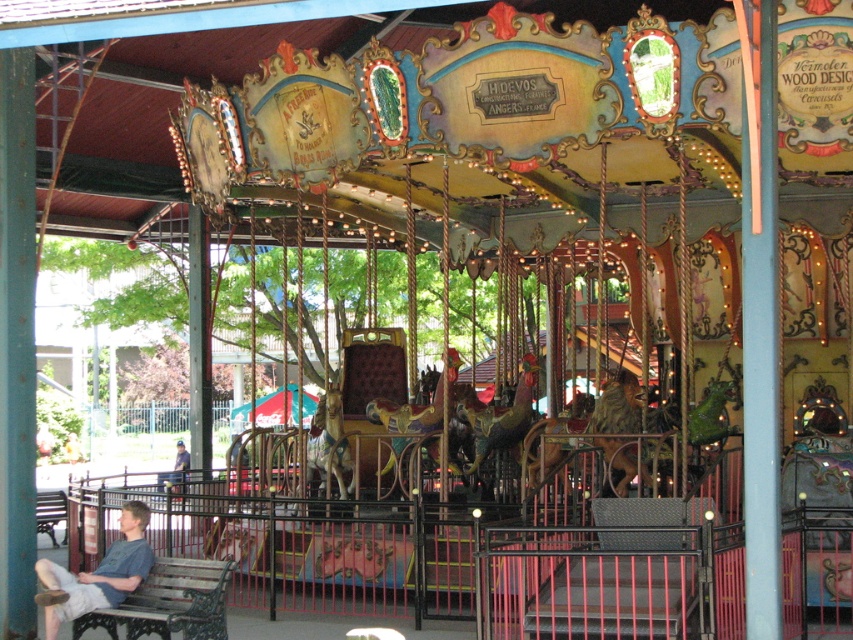
In the scene shown: You are a parent with a young child who wants to sit and watch the carousel. You see both the wooden bench at lower left and the wooden park bench at lower left. Which bench can accommodate both of you comfortably?

The wooden bench at lower left is larger in size compared to the wooden park bench at lower left, so it can accommodate both you and your child comfortably.